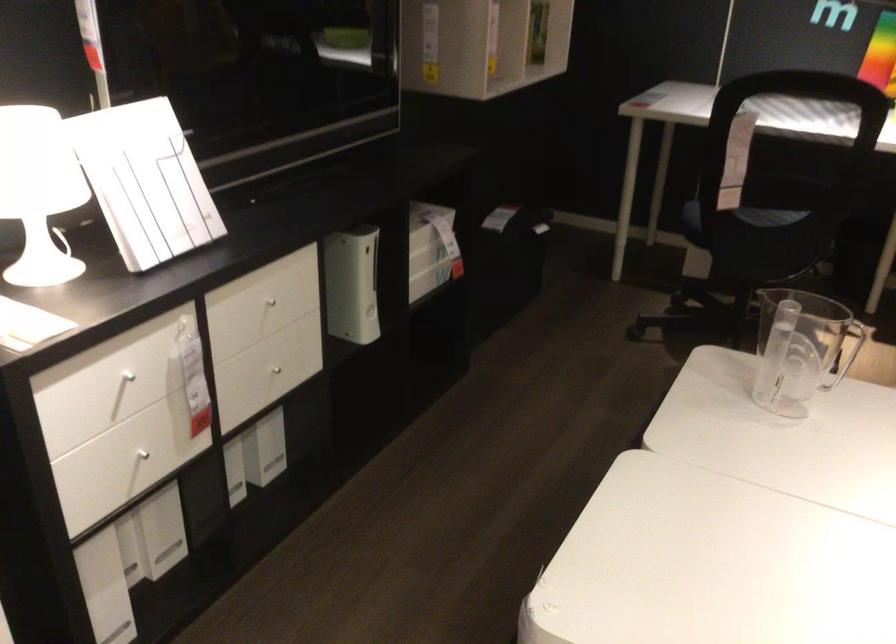
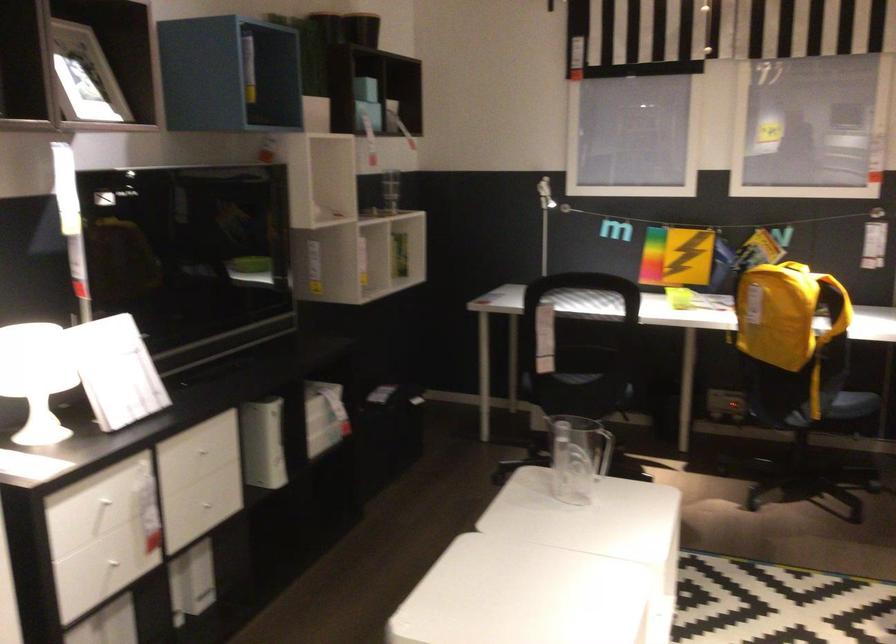
The point at (752,240) is marked in the first image. Where is the corresponding point in the second image?

(571, 393)